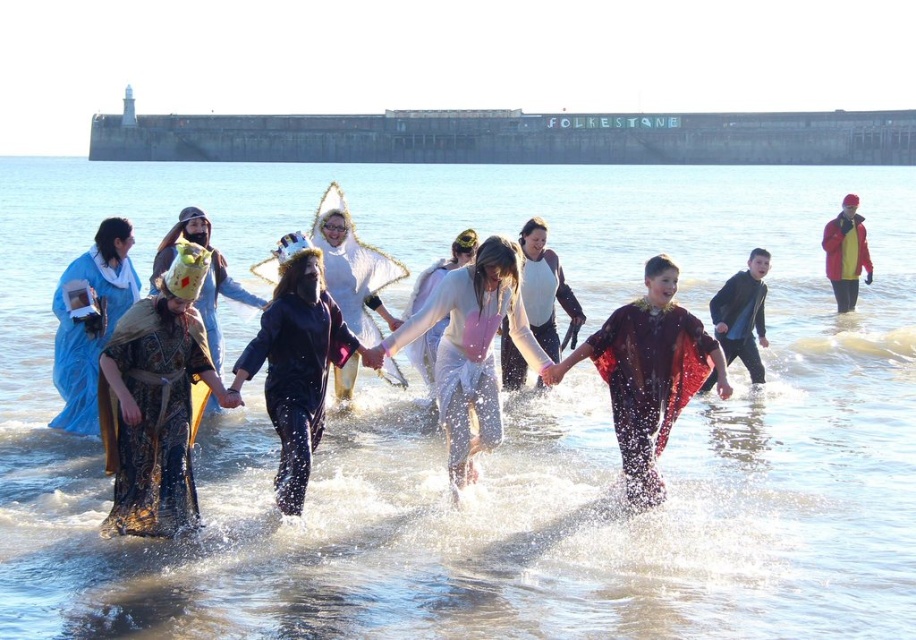
You are a photographer positioned at the camera. You want to capture a closeup shot of the white matte dress at center. Given that your camera can focus on subjects within 10 meters, will you be able to take the closeup?

The white matte dress at center is 43.62 meters away from the camera, which is beyond the camera focus range of 10 meters. Therefore, you cannot take a closeup shot.